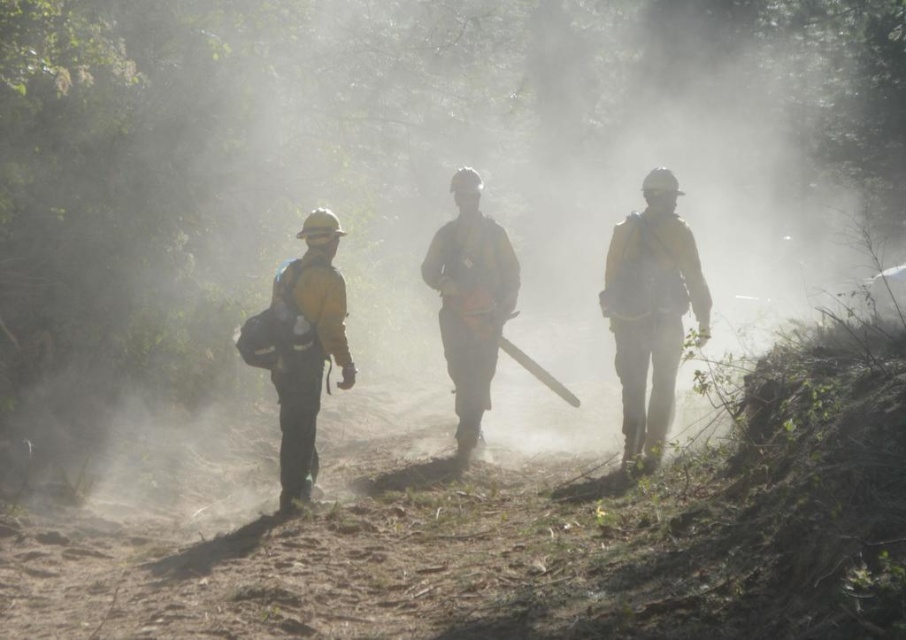
You are a safety inspector assessing the equipment in the scene. You notice the yellow fabric chainsaw at center and the yellow matte uniform at center. Which object is taller?

The yellow fabric chainsaw at center is taller than the yellow matte uniform at center.

You are a firefighter navigating through the misty forest. You need to reach the point at coordinates point (630, 413) and point (440, 250). Which point should you reach first if you want to follow the path that is closer to your current position?

Point (440, 250) is closer to your current position because it is behind point (630, 413). Since point (630, 413) is in front of point (440, 250), you would encounter point (440, 250) first on your path.

You are a safety inspector assessing the visibility of workers in the forest. You notice the yellow matte uniform at right and the yellow fabric chainsaw at center. Which object is shorter in height?

The yellow matte uniform at right is shorter in height compared to the yellow fabric chainsaw at center.